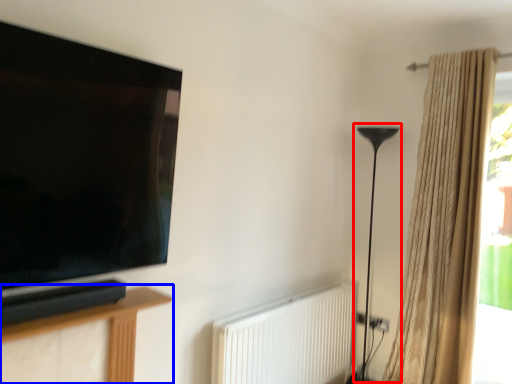
Question: Which point is closer to the camera, table lamp (highlighted by a red box) or furniture (highlighted by a blue box)?

Choices:
 (A) table lamp
 (B) furniture

Answer: (B)